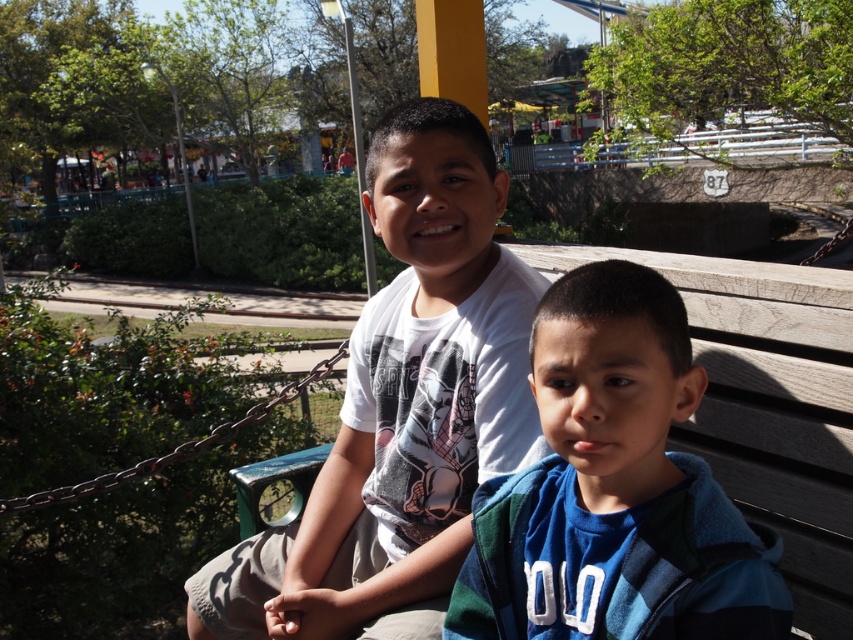
You are a photographer trying to capture a group photo of the two boys. You want to arrange them so that the white cotton shirt at center is to the left of the blue fleece jacket at center. Are they currently positioned in the correct arrangement?

Yes, the white cotton shirt at center is already positioned on the left side of the blue fleece jacket at center, so they are correctly arranged for the photo.

You are a photographer trying to capture a closeup of the white cotton shirt at center. Based on its coordinates, where should you position your camera to ensure it is centered in the frame?

The white cotton shirt at center is located at point coordinates, so positioning the camera directly facing those coordinates would center it in the frame.